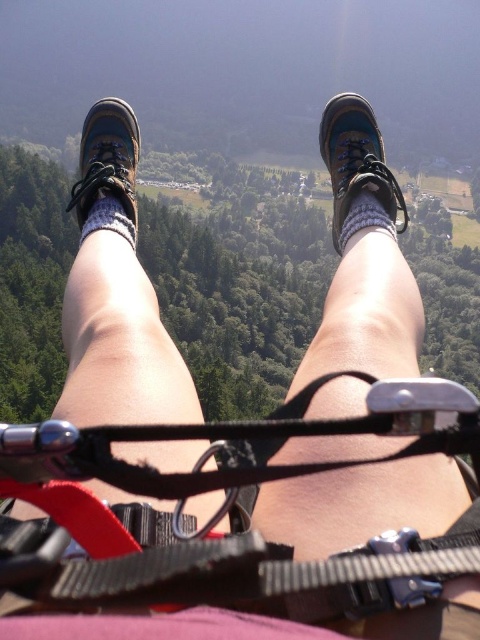
You are a designer creating a custom sock for the gray knitted sock at center. The matte black shoe at left is a key reference. What should be the minimum width of the sock to ensure it fits comfortably inside the shoe?

The gray knitted sock at center should be designed to be narrower than the matte black shoe at left to ensure a snug and comfortable fit inside the shoe.

You are participating in a zipline adventure high above a forest. You notice your brown leather boot at center and your suede sock at center. How far apart are these two items from each other?

The distance between the brown leather boot at center and the suede sock at center is 34.39 meters.

You are participating in an outdoor activity and notice two items in your immediate vicinity. You see the black nylon strap at center and the gray knitted sock at center. Which item is closer to your feet?

The black nylon strap at center is located below the gray knitted sock at center, so the black nylon strap at center is closer to your feet.